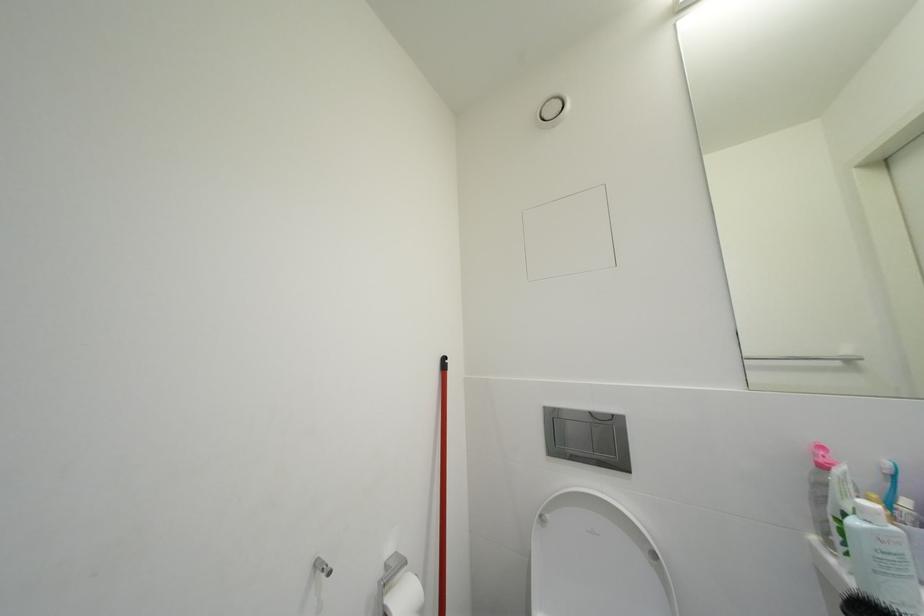
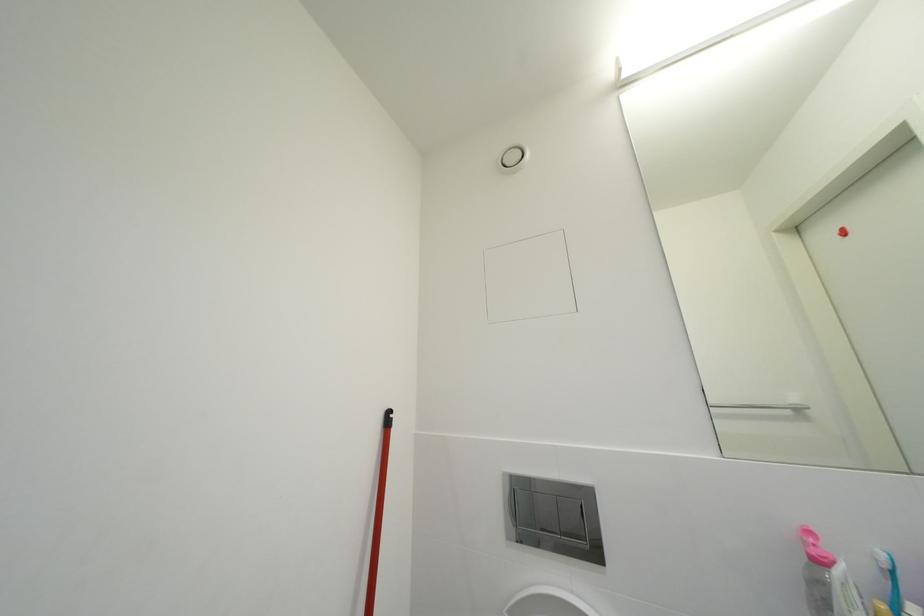
Question: How did the camera likely rotate?

Choices:
 (A) Left
 (B) Right
 (C) Up
 (D) Down

Answer: (C)